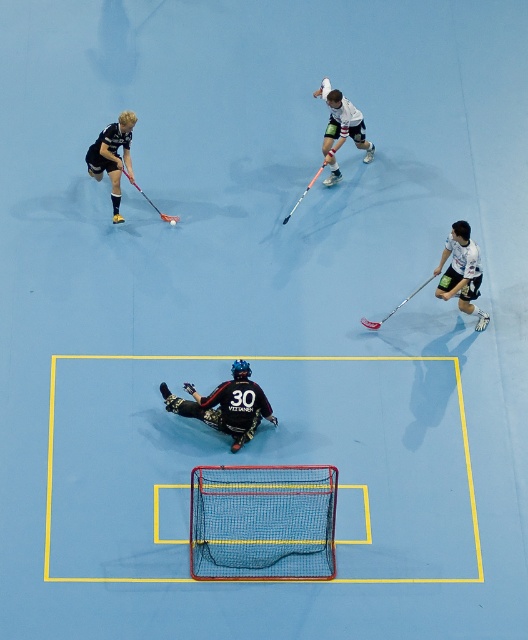
Question: Is white matte hockey stick at upper center thinner than orange metallic hockey stick at center?

Choices:
 (A) no
 (B) yes

Answer: (A)

Question: Which point is closer to the camera taking this photo?

Choices:
 (A) (303, 196)
 (B) (223, 538)
 (C) (142, 189)

Answer: (B)

Question: Which object is the closest to the black matte hockey stick at upper left?

Choices:
 (A) black matte goalie at center
 (B) matte black hockey stick at upper left
 (C) netting fabric at center

Answer: (B)

Question: Among these points, which one is nearest to the camera?

Choices:
 (A) (287, 570)
 (B) (315, 179)
 (C) (127, 129)
 (D) (467, 307)

Answer: (A)

Question: Does white matte hockey stick at upper center lie behind black matte hockey stick at upper left?

Choices:
 (A) yes
 (B) no

Answer: (A)

Question: Is the position of metallic silver hockey stick at lower right more distant than that of matte black hockey stick at upper left?

Choices:
 (A) yes
 (B) no

Answer: (B)